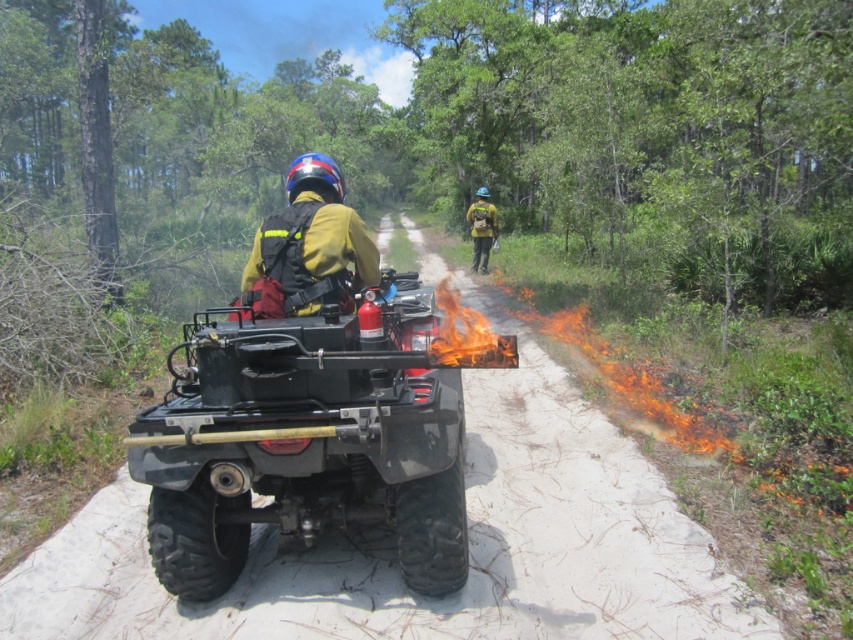
Does point (390, 401) lie in front of point (346, 241)?

Yes, it is.

Does matte black quad at center come behind yellow fire-resistant suit at center?

No, matte black quad at center is closer to the viewer.

Is point (442, 524) farther from viewer compared to point (334, 204)?

No, it is not.

Where is `matte black quad at center`? matte black quad at center is located at coordinates (305, 440).

Can you confirm if matte black quad at center is taller than yellow fabric backpack at center?

Indeed, matte black quad at center has a greater height compared to yellow fabric backpack at center.

Does matte black quad at center lie in front of yellow fabric backpack at center?

Yes, it is.

Who is more distant from viewer, (354, 433) or (477, 209)?

Positioned behind is point (477, 209).

The width and height of the screenshot is (853, 640). I want to click on matte black quad at center, so pyautogui.click(x=305, y=440).

Is dirt track at center taller than matte black quad at center?

No, dirt track at center is not taller than matte black quad at center.

In the scene shown: Who is more forward, (550,611) or (194,552)?

Point (194,552) is in front.

Between point (656, 593) and point (339, 365), which one is positioned in front?

Point (339, 365) is more forward.

Locate an element on the screen. This screenshot has width=853, height=640. dirt track at center is located at coordinates (473, 556).